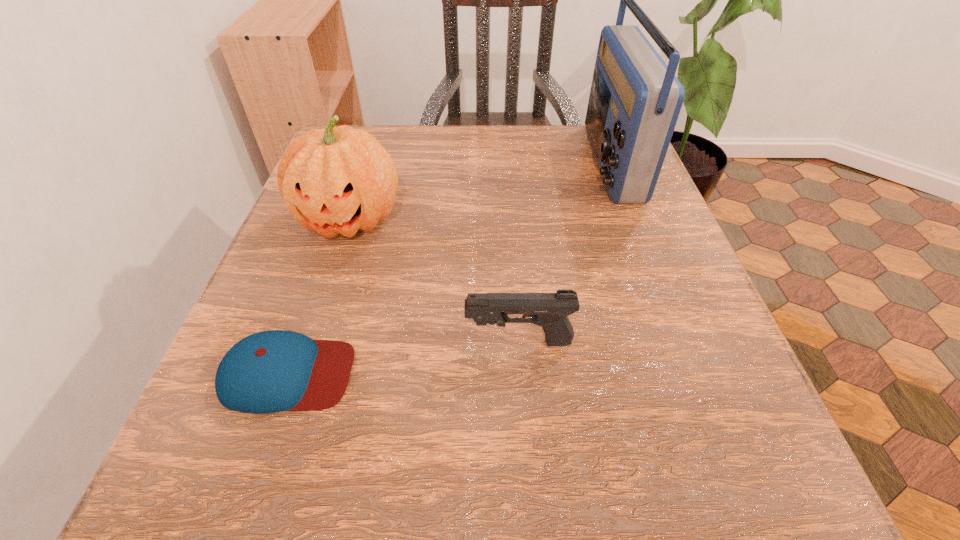
At what (x,y) coordinates should I click in order to perform the action: click on free area in between the pistol and the pumpkin. Please return your answer as a coordinate pair (x, y). The height and width of the screenshot is (540, 960). Looking at the image, I should click on (434, 280).

The height and width of the screenshot is (540, 960). I want to click on free area in between the second shortest object and the radio receiver, so click(x=564, y=252).

The height and width of the screenshot is (540, 960). I want to click on free space between the radio receiver and the shortest object, so click(x=448, y=268).

Identify the location of free space between the shortest object and the pistol. The width and height of the screenshot is (960, 540). (403, 358).

The image size is (960, 540). I want to click on the second closest object to the pumpkin, so click(x=548, y=310).

The height and width of the screenshot is (540, 960). In order to click on the third closest object relative to the radio receiver in this screenshot , I will do `click(271, 371)`.

You are a GUI agent. You are given a task and a screenshot of the screen. Output one action in this format:
    pyautogui.click(x=<x>, y=<y>)
    Task: Click on the vacant space that satisfies the following two spatial constraints: 1. on the carved face of the third shortest object; 2. with the bill of the baseball cap facing forward
    The width and height of the screenshot is (960, 540).
    Given the screenshot: What is the action you would take?
    pyautogui.click(x=300, y=374)